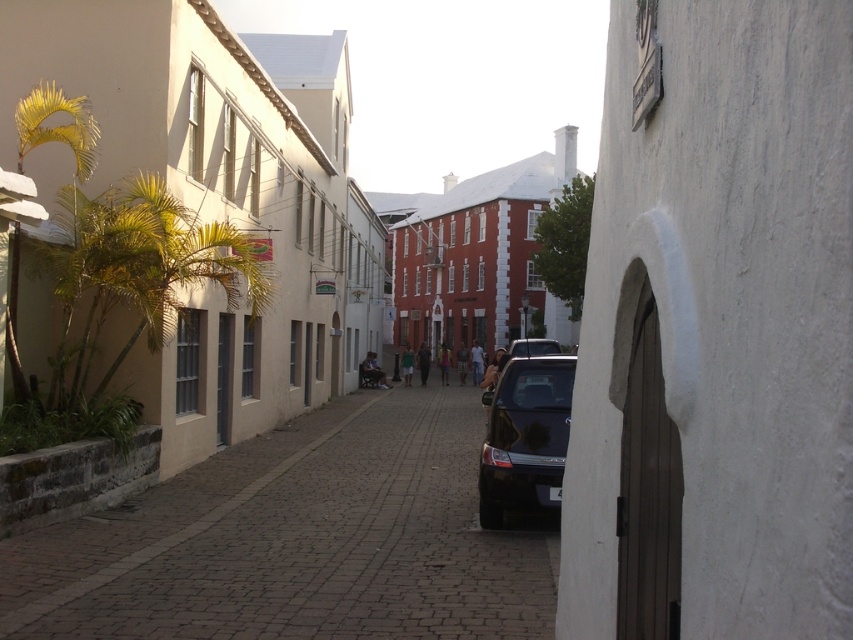
What do you see at coordinates (299, 540) in the screenshot?
I see `brown cobblestone street at center` at bounding box center [299, 540].

What do you see at coordinates (299, 540) in the screenshot?
I see `brown cobblestone street at center` at bounding box center [299, 540].

Find the location of a particular element. brown cobblestone street at center is located at coordinates (299, 540).